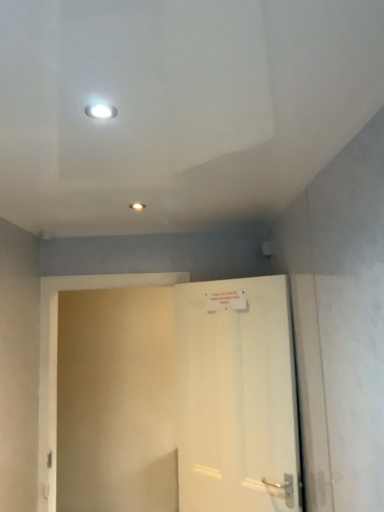
Question: Considering the relative positions of white glossy light fixture at upper center and white matte door at center in the image provided, is white glossy light fixture at upper center to the left of white matte door at center from the viewer's perspective?

Choices:
 (A) yes
 (B) no

Answer: (A)

Question: Is white matte door at center surrounded by white glossy light fixture at upper center?

Choices:
 (A) no
 (B) yes

Answer: (A)

Question: From the image's perspective, would you say white glossy light fixture at upper center is positioned over white matte door at center?

Choices:
 (A) yes
 (B) no

Answer: (A)

Question: Is white glossy light fixture at upper center not inside white matte door at center?

Choices:
 (A) yes
 (B) no

Answer: (A)

Question: Is white matte door at center at the back of white glossy light fixture at upper center?

Choices:
 (A) yes
 (B) no

Answer: (B)

Question: Considering the relative sizes of white glossy light fixture at upper center and white matte door at center in the image provided, is white glossy light fixture at upper center thinner than white matte door at center?

Choices:
 (A) no
 (B) yes

Answer: (B)

Question: From a real-world perspective, is white matte door at center positioned over white glossy light fixture at upper center based on gravity?

Choices:
 (A) yes
 (B) no

Answer: (B)

Question: Is white matte door at center facing away from white glossy light fixture at upper center?

Choices:
 (A) yes
 (B) no

Answer: (B)

Question: Does white matte door at center have a greater width compared to white glossy light fixture at upper center?

Choices:
 (A) no
 (B) yes

Answer: (B)

Question: Considering the relative positions of white matte door at center and white glossy light fixture at upper center in the image provided, is white matte door at center to the right of white glossy light fixture at upper center from the viewer's perspective?

Choices:
 (A) yes
 (B) no

Answer: (A)

Question: From the image's perspective, does white matte door at center appear higher than white glossy light fixture at upper center?

Choices:
 (A) no
 (B) yes

Answer: (A)

Question: Considering the relative sizes of white matte door at center and white glossy light fixture at upper center in the image provided, is white matte door at center shorter than white glossy light fixture at upper center?

Choices:
 (A) no
 (B) yes

Answer: (A)

Question: In terms of height, does white matte door at center look taller or shorter compared to white glossy light fixture at upper center?

Choices:
 (A) short
 (B) tall

Answer: (B)